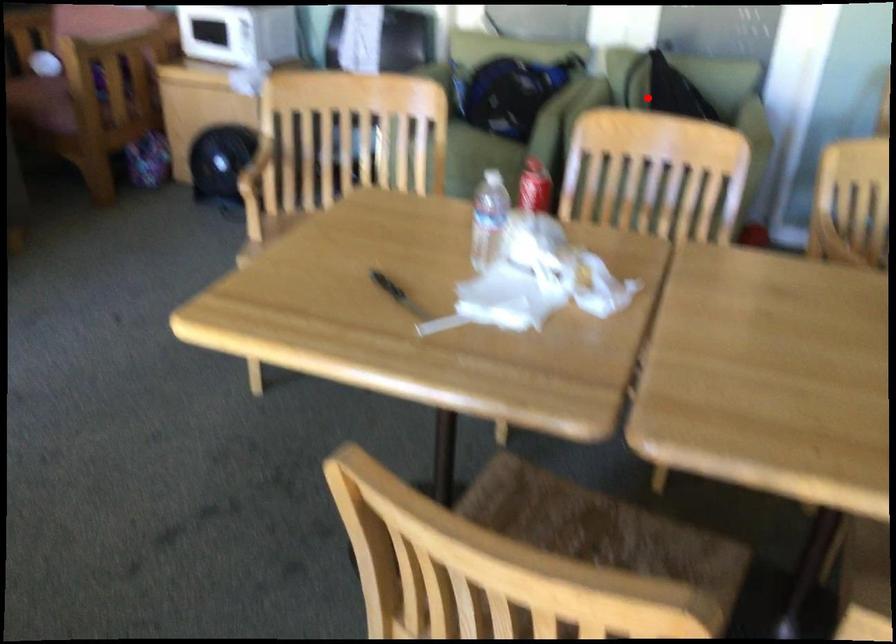
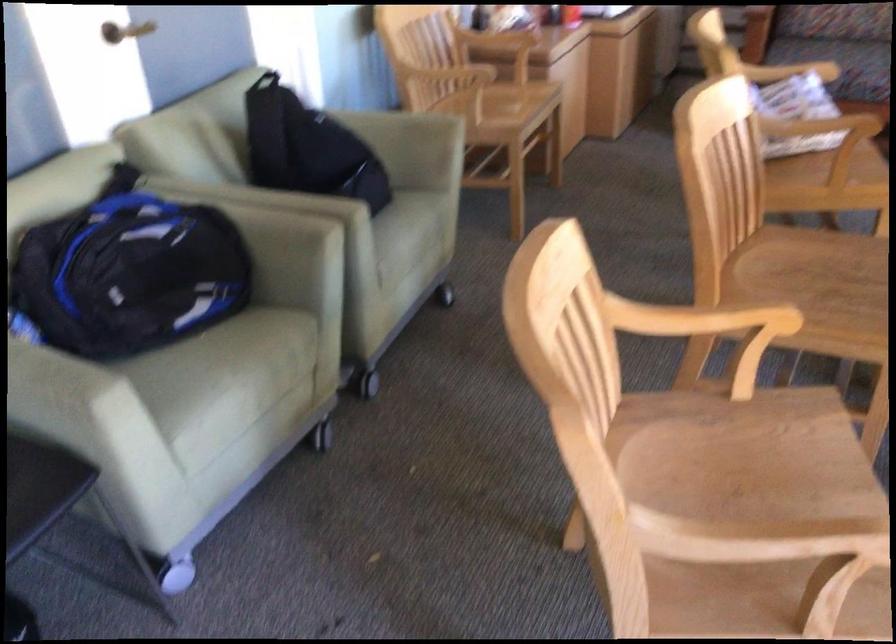
Locate, in the second image, the point that corresponds to the highlighted location in the first image.

(307, 147)